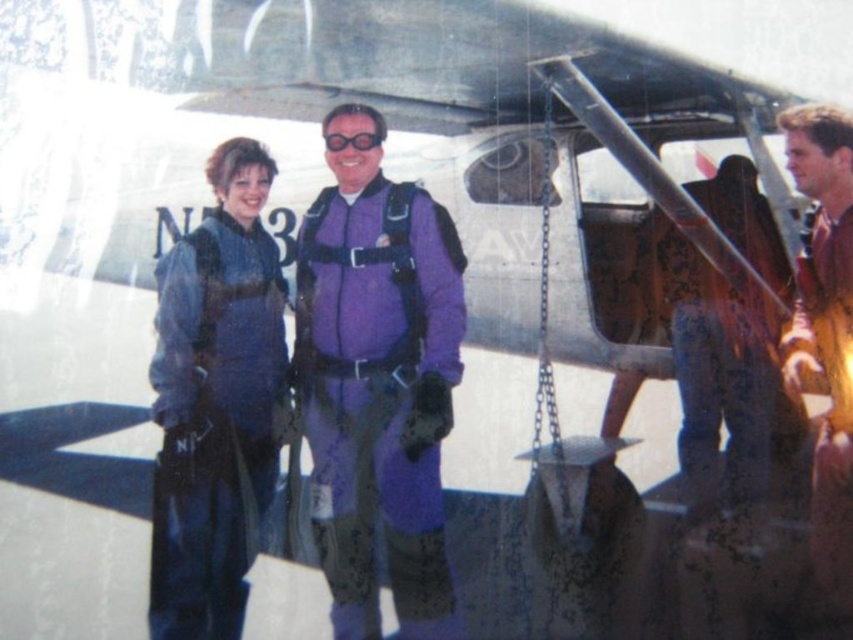
Between blue fabric jacket at center and brown leather jacket at right, which one has less height?

Standing shorter between the two is brown leather jacket at right.

Image resolution: width=853 pixels, height=640 pixels. Describe the element at coordinates (215, 401) in the screenshot. I see `blue fabric jacket at center` at that location.

At what (x,y) coordinates should I click in order to perform the action: click on blue fabric jacket at center. Please return your answer as a coordinate pair (x, y). Image resolution: width=853 pixels, height=640 pixels. Looking at the image, I should click on (215, 401).

Does point (193, 292) lie in front of point (334, 134)?

Yes, it is in front of point (334, 134).

Which is in front, point (216, 452) or point (374, 138)?

Positioned in front is point (216, 452).

Image resolution: width=853 pixels, height=640 pixels. Identify the location of blue fabric jacket at center. (215, 401).

Where is `blue fabric jacket at center`? blue fabric jacket at center is located at coordinates (215, 401).

Measure the distance between brown leather jacket at right and clear plastic goggles at center.

A distance of 5.85 feet exists between brown leather jacket at right and clear plastic goggles at center.

Who is more forward, (805, 291) or (344, 134)?

Positioned in front is point (805, 291).

Where is `brown leather jacket at right`? brown leather jacket at right is located at coordinates (819, 230).